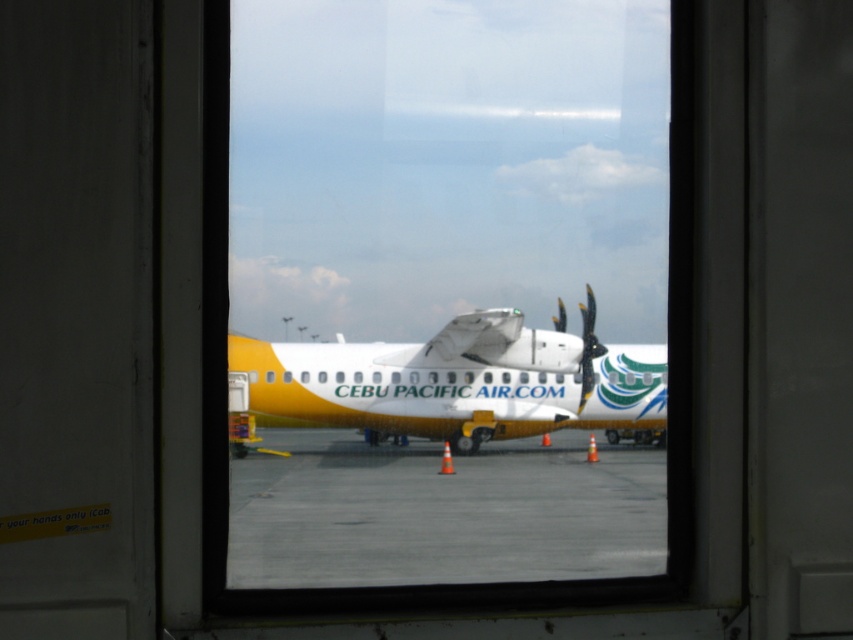
You are an airport maintenance worker who needs to clean the polished metallic propeller at right. You are currently standing on the concrete tarmac at center. Which direction should you move to reach the propeller?

The concrete tarmac at center is in front of the polished metallic propeller at right, so you should move backward to reach the propeller.

You are a maintenance worker who needs to inspect the concrete tarmac at center and the yellow matte airplane at center. Which object is located below the other?

The concrete tarmac at center is positioned under the yellow matte airplane at center, so the concrete tarmac is below the airplane.

You are a maintenance worker needing to reach the polished metallic propeller at right from the transparent glass airplane at center. Given that your ladder is 20 centimeters long, will it be sufficient to bridge the gap between them?

The distance between the transparent glass airplane at center and the polished metallic propeller at right is 23.90 centimeters. Since the ladder is only 20 centimeters long, it is shorter than the required distance. Therefore, the ladder will not be sufficient to bridge the gap between them.